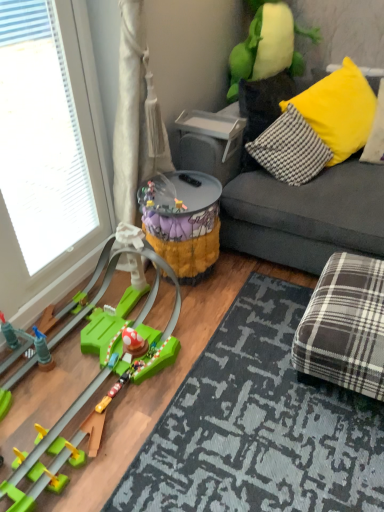
Question: Is camouflage fabric bucket at center, arranged as the second toy when viewed from the top, smaller than transparent glass window at left?

Choices:
 (A) yes
 (B) no

Answer: (B)

Question: Is transparent glass window at left at the back of camouflage fabric bucket at center, which ranks as the 2th toy in bottom-to-top order?

Choices:
 (A) yes
 (B) no

Answer: (B)

Question: Can you confirm if camouflage fabric bucket at center, arranged as the second toy when viewed from the top, is positioned to the left of transparent glass window at left?

Choices:
 (A) no
 (B) yes

Answer: (A)

Question: Does camouflage fabric bucket at center, arranged as the second toy when viewed from the top, have a larger size compared to transparent glass window at left?

Choices:
 (A) no
 (B) yes

Answer: (B)

Question: Can you confirm if camouflage fabric bucket at center, arranged as the second toy when viewed from the top, is taller than transparent glass window at left?

Choices:
 (A) no
 (B) yes

Answer: (A)

Question: Does camouflage fabric bucket at center, which ranks as the 2th toy in bottom-to-top order, touch transparent glass window at left?

Choices:
 (A) no
 (B) yes

Answer: (A)

Question: Is yellow fabric pillow at upper right smaller than plaid fabric mat at lower right?

Choices:
 (A) yes
 (B) no

Answer: (B)

Question: Would you say yellow fabric pillow at upper right is outside plaid fabric mat at lower right?

Choices:
 (A) yes
 (B) no

Answer: (A)

Question: Can you confirm if yellow fabric pillow at upper right is positioned to the right of plaid fabric mat at lower right?

Choices:
 (A) yes
 (B) no

Answer: (A)

Question: Considering the relative positions of yellow fabric pillow at upper right and plaid fabric mat at lower right in the image provided, is yellow fabric pillow at upper right to the left of plaid fabric mat at lower right from the viewer's perspective?

Choices:
 (A) yes
 (B) no

Answer: (B)

Question: Is yellow fabric pillow at upper right touching plaid fabric mat at lower right?

Choices:
 (A) no
 (B) yes

Answer: (A)

Question: Is yellow fabric pillow at upper right taller than plaid fabric mat at lower right?

Choices:
 (A) no
 (B) yes

Answer: (B)

Question: From a real-world perspective, is green plastic toy at lower left, acting as the first toy starting from the bottom, positioned under transparent glass window at left based on gravity?

Choices:
 (A) no
 (B) yes

Answer: (B)